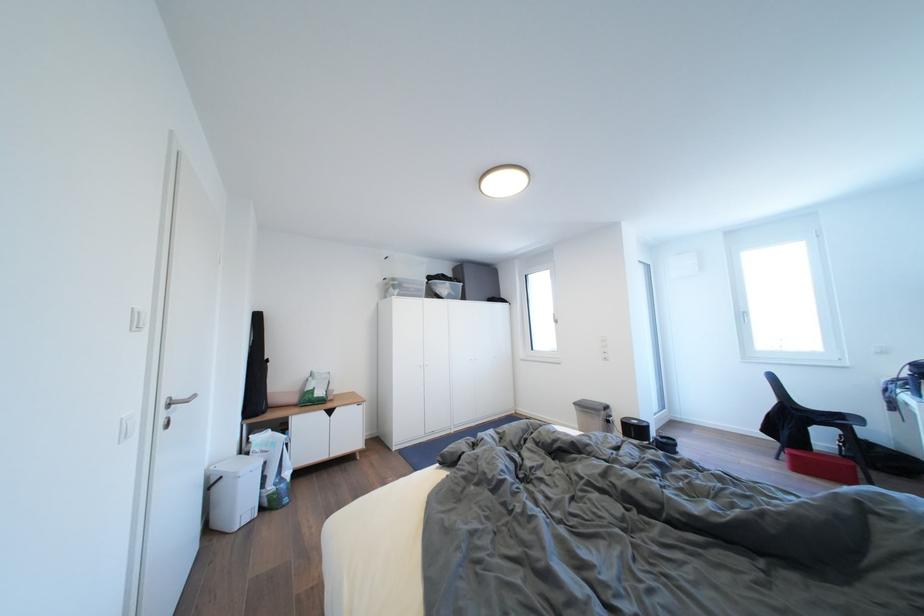
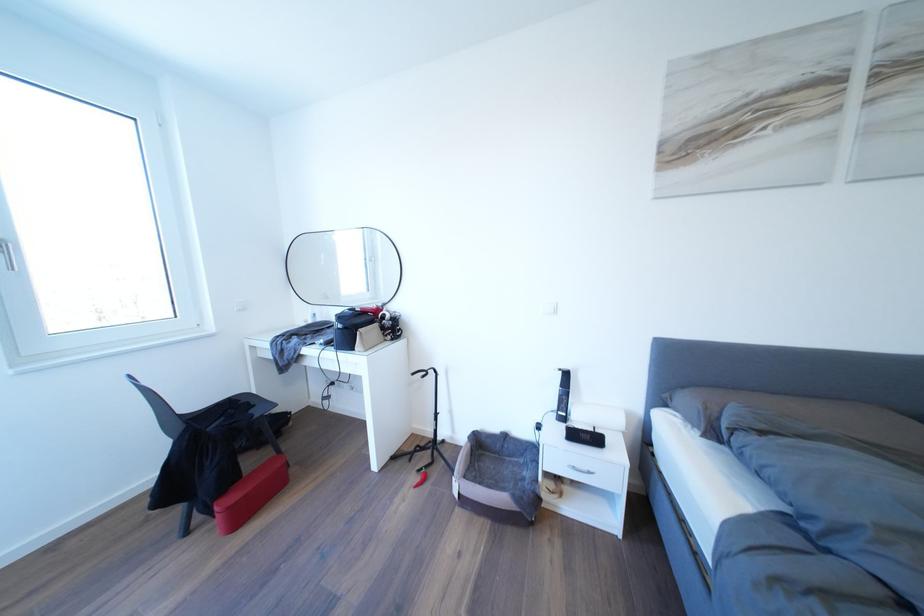
Locate, in the second image, the point that corresponds to [749,321] in the first image.

(6, 254)